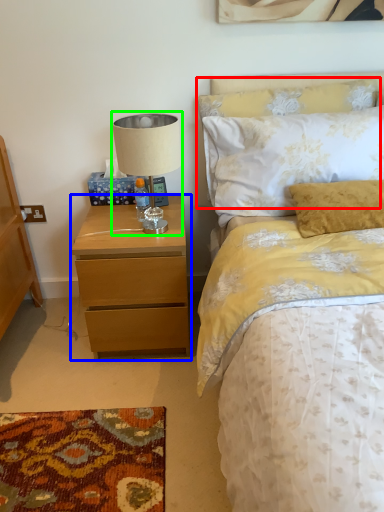
Question: Considering the real-world distances, which object is farthest from pillow (highlighted by a red box)? nightstand (highlighted by a blue box) or table lamp (highlighted by a green box)?

Choices:
 (A) nightstand
 (B) table lamp

Answer: (A)